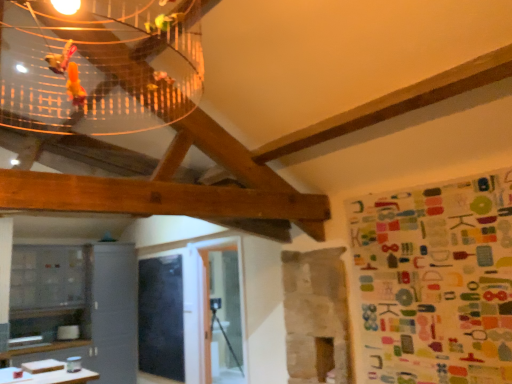
Question: Is black matte board at center in front of or behind multicolored fabric at right in the image?

Choices:
 (A) behind
 (B) front

Answer: (A)

Question: In terms of width, does black matte board at center look wider or thinner when compared to multicolored fabric at right?

Choices:
 (A) wide
 (B) thin

Answer: (B)

Question: From a real-world perspective, relative to multicolored fabric at right, is black matte board at center vertically above or below?

Choices:
 (A) below
 (B) above

Answer: (A)

Question: Is point (432, 367) closer or farther from the camera than point (163, 336)?

Choices:
 (A) farther
 (B) closer

Answer: (B)

Question: Considering the positions of multicolored fabric at right and black matte board at center in the image, is multicolored fabric at right taller or shorter than black matte board at center?

Choices:
 (A) short
 (B) tall

Answer: (A)

Question: From the image's perspective, is multicolored fabric at right above or below black matte board at center?

Choices:
 (A) above
 (B) below

Answer: (A)

Question: From a real-world perspective, is multicolored fabric at right above or below black matte board at center?

Choices:
 (A) below
 (B) above

Answer: (B)